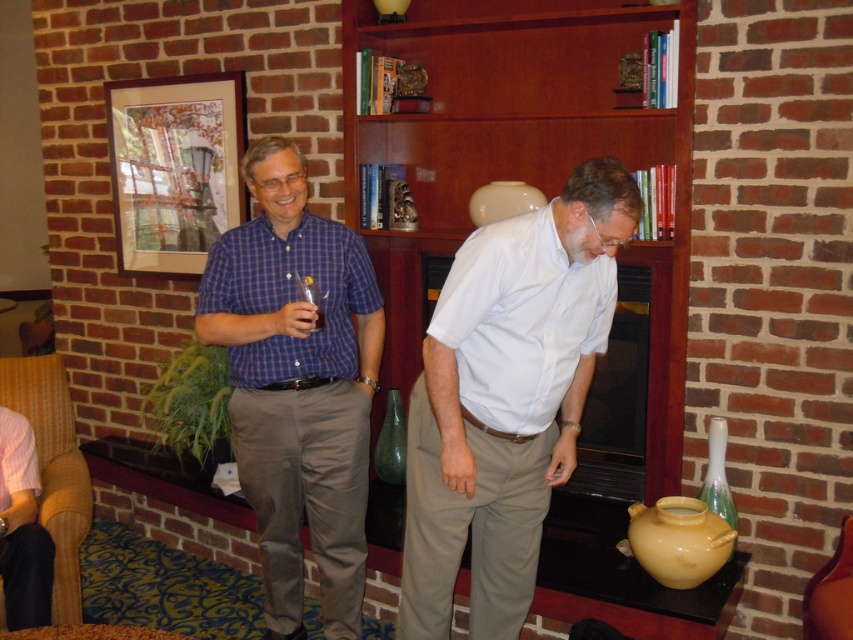
You are a photographer setting up for an event. You need to position a spotlight above the white matte shirt at center so it doesn t cast a shadow on the black glass fireplace at center. Is this possible given their positions?

The white matte shirt at center is positioned under the black glass fireplace at center. Since the shirt is below the fireplace, placing a spotlight above the shirt would not cast a shadow on the fireplace as the shirt is already beneath it.

You are standing at the entrance of the room and want to place a new painting on the wall near the wooden bookshelf at center. Based on the coordinates provided, where should you position the painting relative to the bookshelf?

The wooden bookshelf at center is located at coordinates point (534, 186), so you should position the new painting near those coordinates to place it close to the bookshelf.

You are a photographer setting up a shoot in this scene. You need to position a light source so that it illuminates both the white matte shirt at center and the black glass fireplace at center without casting shadows. Given their heights, which object should be placed closer to the light source?

The white matte shirt at center is taller than the black glass fireplace at center, so to ensure both are evenly illuminated, the black glass fireplace at center should be placed closer to the light source.